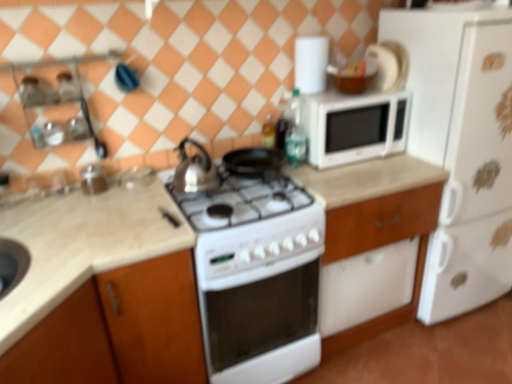
Locate an element on the screen. This screenshot has height=384, width=512. vacant area in front of white matte microwave at upper center is located at coordinates (357, 171).